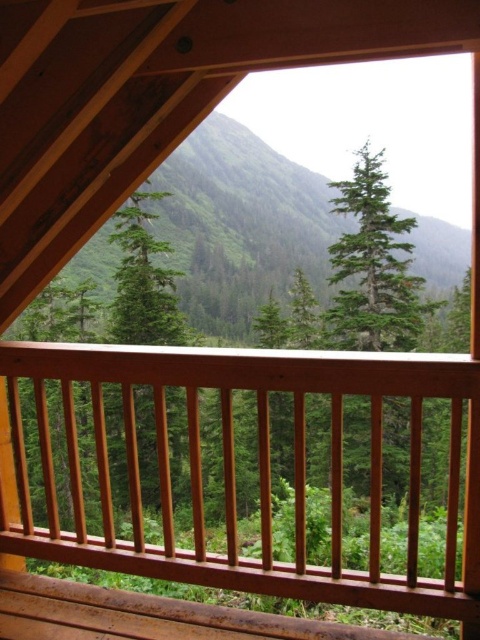
You are standing inside the wooden structure and want to touch both the smooth wood railing at center and the green matte tree at center. Which object is closer to you?

The smooth wood railing at center is closer to you than the green matte tree at center because it is only 33.60 feet away from the tree, meaning the railing is right in front of you while the tree is farther back.